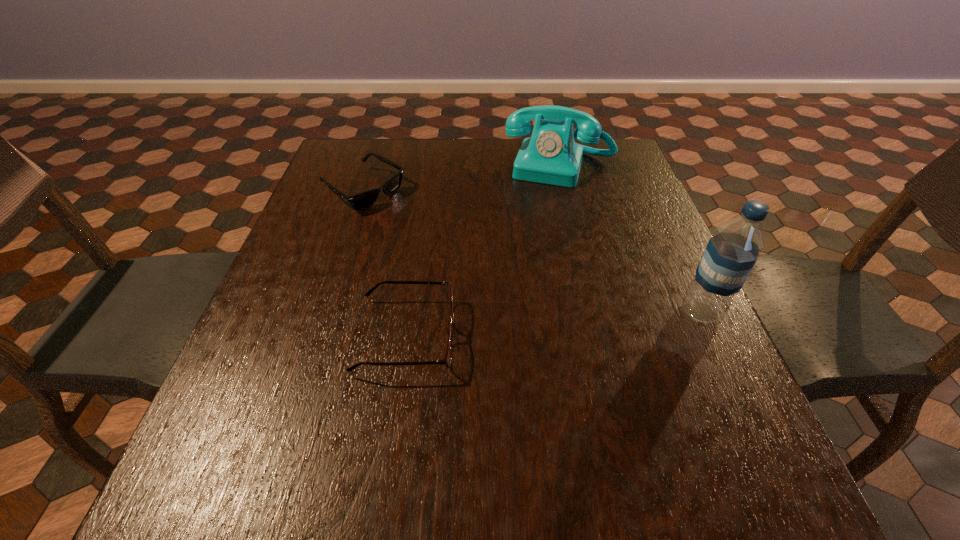
Identify the location of spectacles. (446, 361).

Locate an element on the screen. The image size is (960, 540). the rightmost object is located at coordinates (731, 253).

Where is `the tallest object`? the tallest object is located at coordinates (731, 253).

What are the coordinates of `sunglasses` in the screenshot? It's located at (363, 200).

The image size is (960, 540). Find the location of `the third shortest object`. the third shortest object is located at coordinates (550, 156).

Locate an element on the screen. Image resolution: width=960 pixels, height=540 pixels. telephone is located at coordinates (550, 156).

At what (x,y) coordinates should I click in order to perform the action: click on vacant space located on the lenses of the spectacles. Please return your answer as a coordinate pair (x, y). This screenshot has width=960, height=540. Looking at the image, I should click on (563, 336).

This screenshot has height=540, width=960. What are the coordinates of `vacant region located 0.230m on the label of the rightmost object` in the screenshot? It's located at (566, 312).

You are a GUI agent. You are given a task and a screenshot of the screen. Output one action in this format:
    pyautogui.click(x=<x>, y=<y>)
    Task: Click on the free location located 0.330m on the label of the rightmost object
    The height and width of the screenshot is (540, 960).
    Given the screenshot: What is the action you would take?
    pyautogui.click(x=517, y=312)

At what (x,y) coordinates should I click in order to perform the action: click on vacant region located on the label of the rightmost object. Please return your answer as a coordinate pair (x, y). Image resolution: width=960 pixels, height=540 pixels. Looking at the image, I should click on (502, 312).